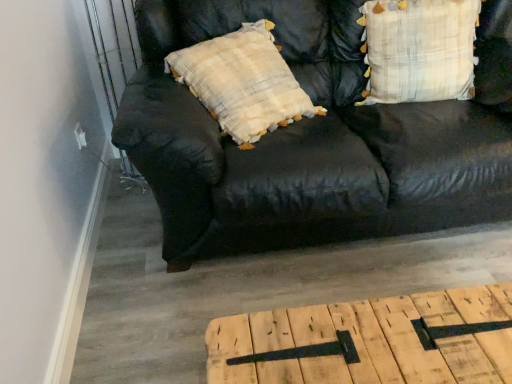
Question: Does point (501, 362) appear closer or farther from the camera than point (406, 77)?

Choices:
 (A) closer
 (B) farther

Answer: (A)

Question: In terms of height, does light brown wood table at lower center look taller or shorter compared to plaid fabric pillow at upper right?

Choices:
 (A) short
 (B) tall

Answer: (A)

Question: Which of these objects is positioned farthest from the plaid fabric pillow at upper right?

Choices:
 (A) light brown wood table at lower center
 (B) black leather couch at center

Answer: (A)

Question: Based on their relative distances, which object is nearer to the light brown wood table at lower center?

Choices:
 (A) plaid fabric pillow at upper right
 (B) black leather couch at center

Answer: (B)